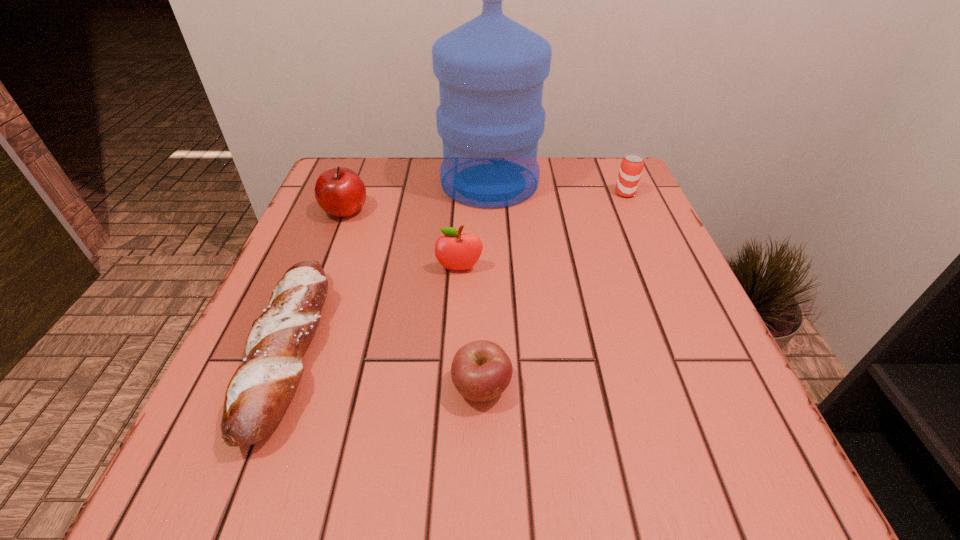
Locate which apple is the closest to the shortest apple. Please provide its 2D coordinates. Your answer should be formatted as a tuple, i.e. [(x, y)], where the tuple contains the x and y coordinates of a point satisfying the conditions above.

[(455, 251)]

Where is `vacant position in the image that satisfies the following two spatial constraints: 1. on the back side of the farthest apple; 2. on the right side of the beer can`? This screenshot has height=540, width=960. vacant position in the image that satisfies the following two spatial constraints: 1. on the back side of the farthest apple; 2. on the right side of the beer can is located at coordinates (352, 193).